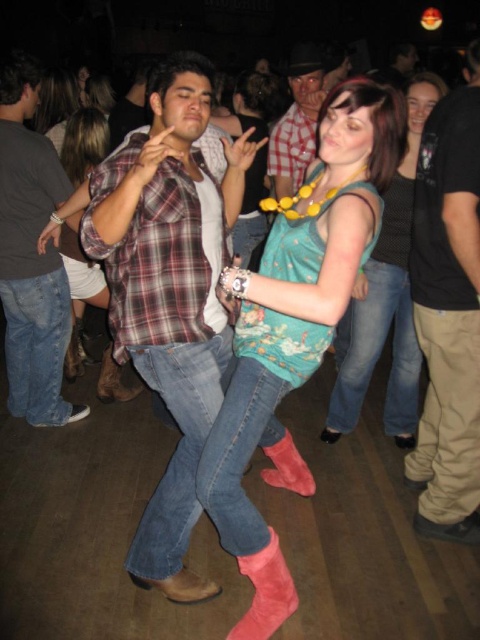
Between black cotton shirt at right and brushed metal shirt at center, which one appears on the right side from the viewer's perspective?

black cotton shirt at right

Can you confirm if black cotton shirt at right is positioned to the left of brushed metal shirt at center?

In fact, black cotton shirt at right is to the right of brushed metal shirt at center.

Who is more forward, (450,250) or (60,300)?

Point (450,250) is in front.

Find the location of a particular element. Image resolution: width=480 pixels, height=640 pixels. black cotton shirt at right is located at coordinates (448, 312).

Is plaid shirt at center wider than suede pink boot at lower center?

Indeed, plaid shirt at center has a greater width compared to suede pink boot at lower center.

Who is taller, plaid shirt at center or suede pink boot at lower center?

plaid shirt at center is taller.

Is point (118, 291) in front of point (262, 604)?

Yes, point (118, 291) is in front of point (262, 604).

At what (x,y) coordinates should I click in order to perform the action: click on plaid shirt at center. Please return your answer as a coordinate pair (x, y). Looking at the image, I should click on (169, 292).

Does checkered fabric shirt at center have a larger size compared to suede pink boot at lower center?

Correct, checkered fabric shirt at center is larger in size than suede pink boot at lower center.

The height and width of the screenshot is (640, 480). In order to click on checkered fabric shirt at center in this screenshot , I will do tap(297, 122).